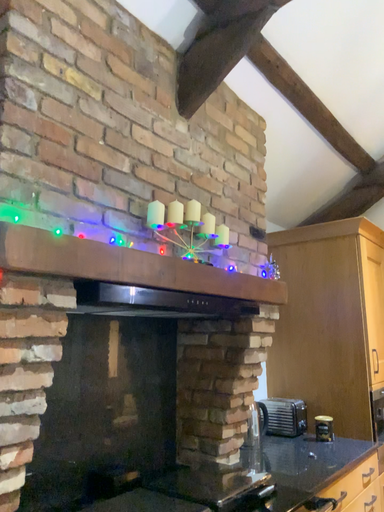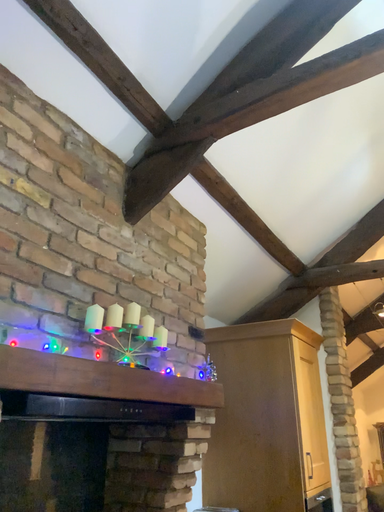
Question: How did the camera likely rotate when shooting the video?

Choices:
 (A) rotated right
 (B) rotated left

Answer: (A)